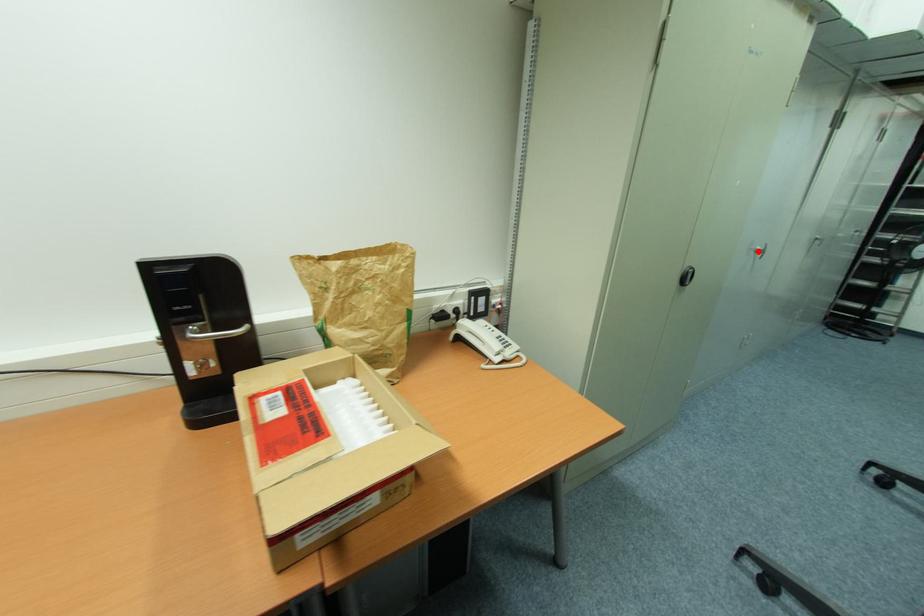
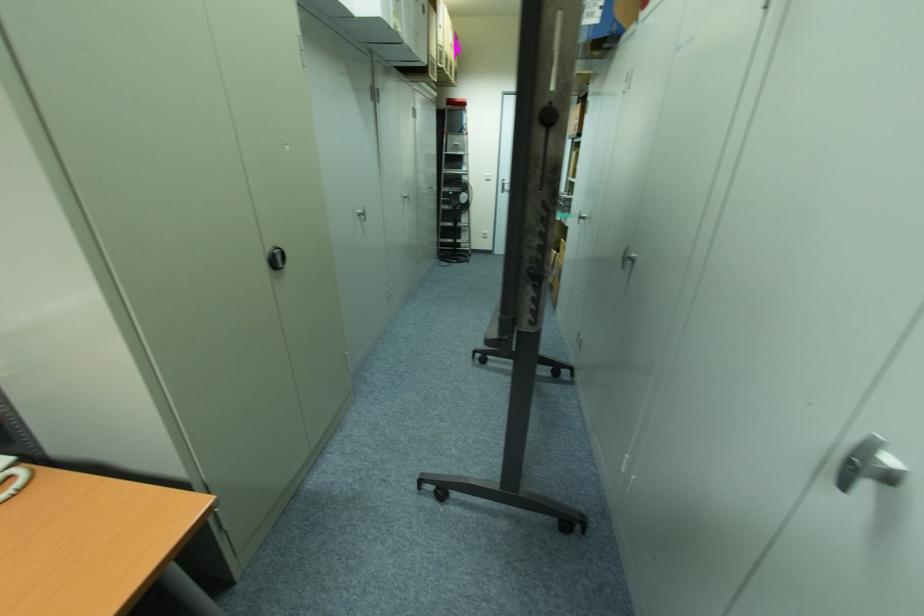
Locate, in the second image, the point that corresponds to the highlighted location in the first image.

(361, 215)